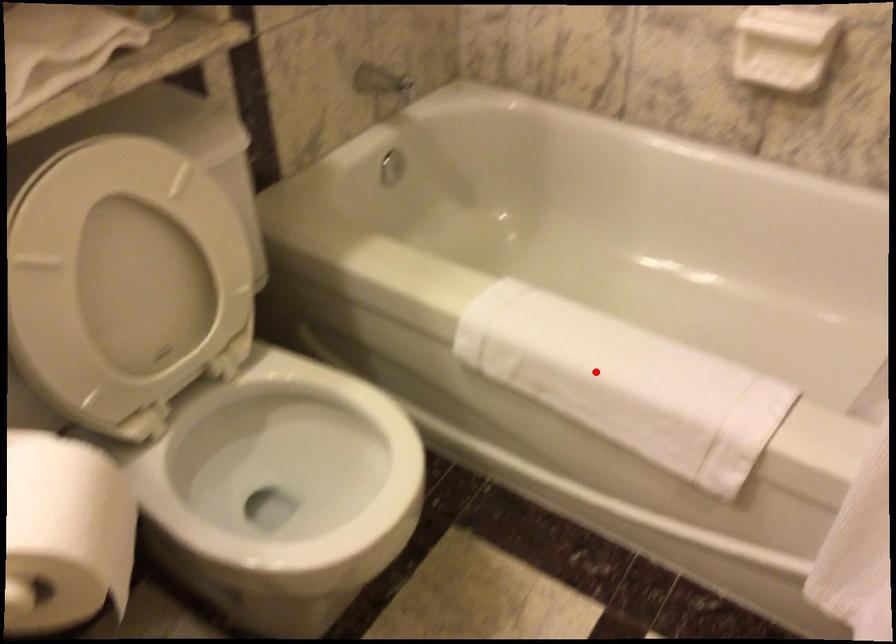
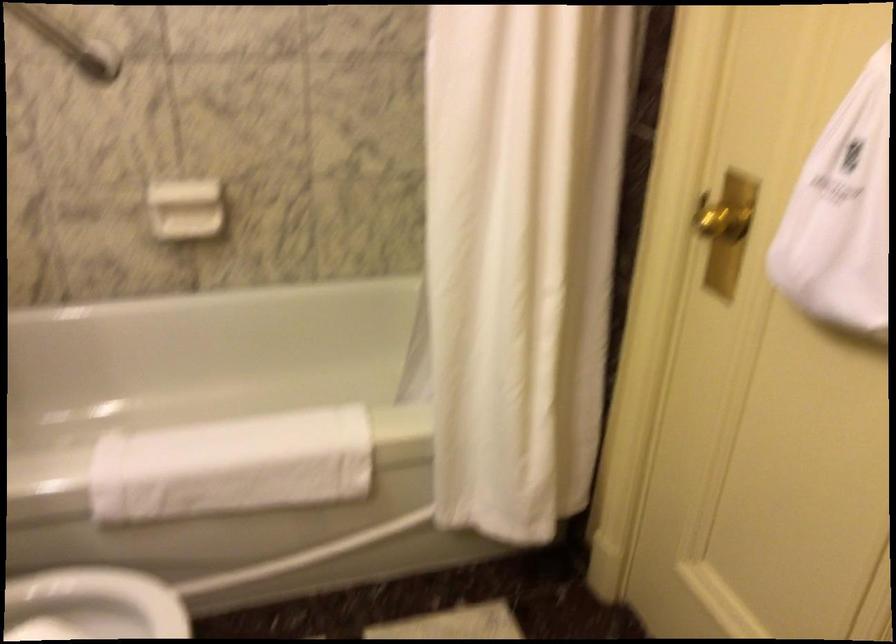
Find the pixel in the second image that matches the highlighted location in the first image.

(231, 466)